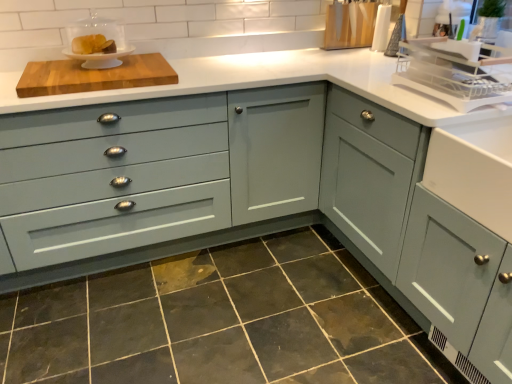
The width and height of the screenshot is (512, 384). I want to click on free space above dark gray granite at lower center (from a real-world perspective), so click(220, 309).